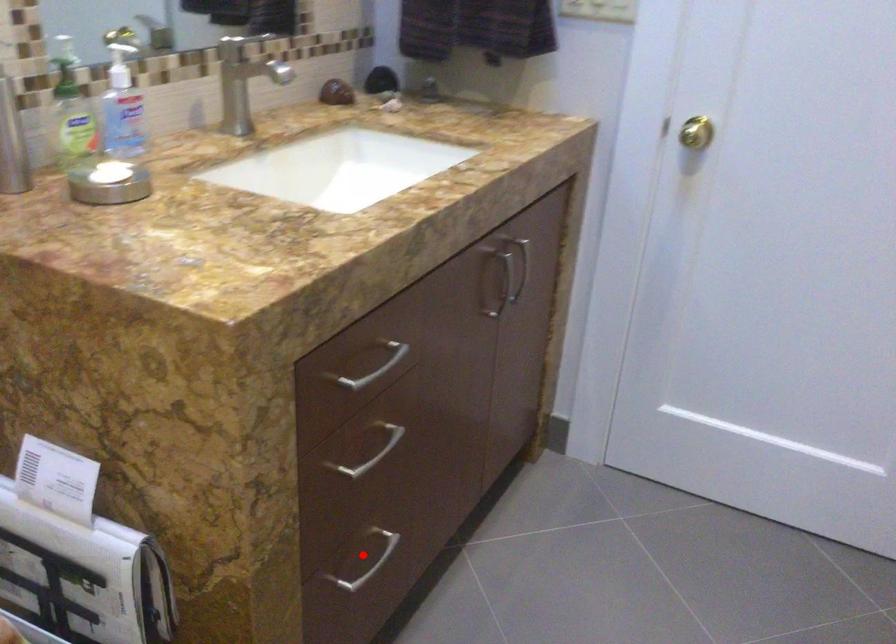
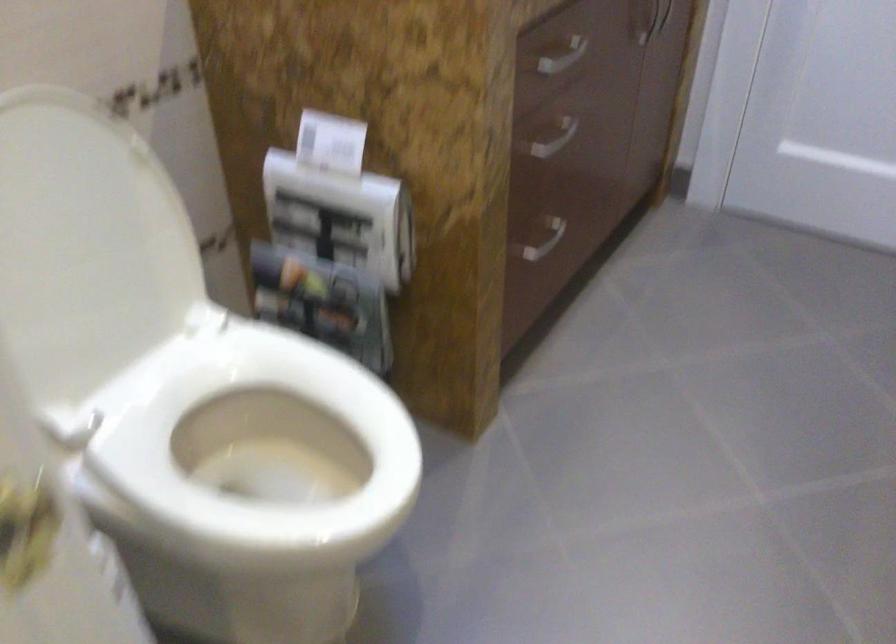
Find the pixel in the second image that matches the highlighted location in the first image.

(538, 238)